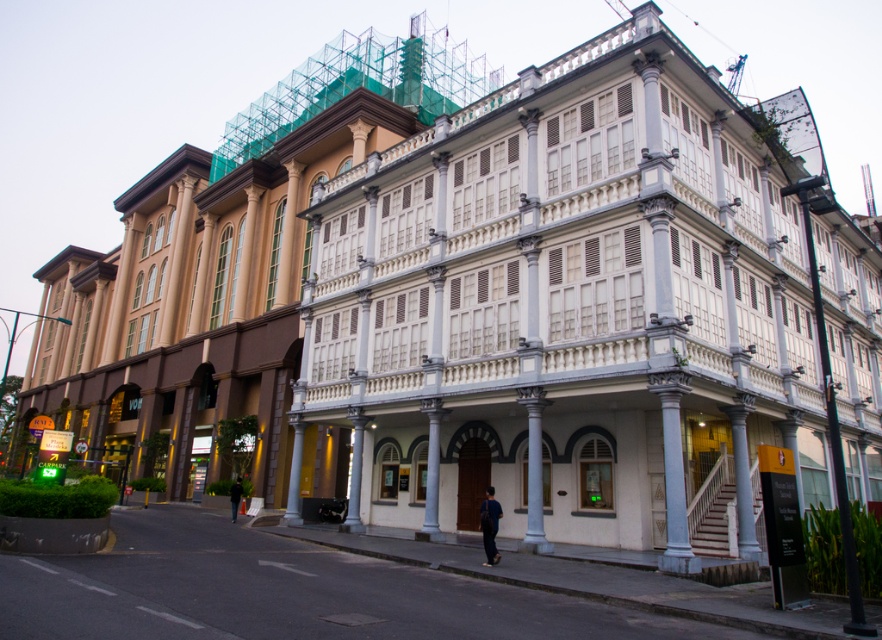
You are a construction worker assessing the street layout. You need to install a new streetlight that must be placed between the white marble building at center and the gray stone column at center. Considering their heights, which object will cast a longer shadow at sunset?

The white marble building at center is much taller than the gray stone column at center, so it will cast a longer shadow at sunset.

You are standing on the street looking at the two buildings. You notice two points marked on the image. The first point is at coordinate [432,496] and the second at [496,557]. Which point is closer to you as you stand on the street?

The point at coordinate [432,496] is closer to you because it is further to the viewer than the point at [496,557].

Based on the photo, you are standing at the point marked by the coordinates point (594, 305) in the image. Which building are you facing? The modern beige building with arched windows or the older white marble building with decorative railings?

The point (594, 305) marks the white marble building at center, so you are facing the older white marble building with decorative railings.